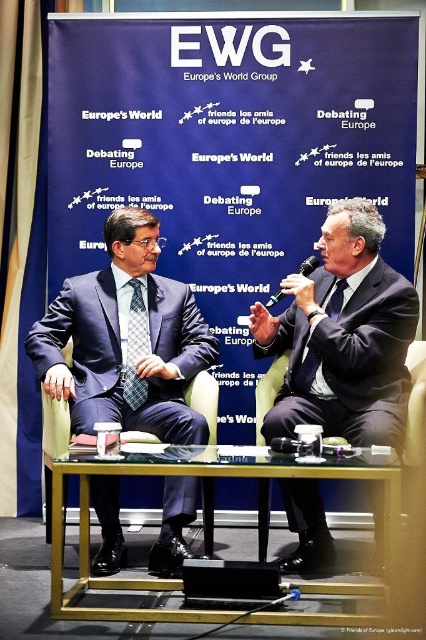
You are attending the EWG conference and need to identify which suit is larger between the matte blue suit at center and the matte black suit at center. Based on the scene description, which one is bigger?

The matte blue suit at center is bigger than the matte black suit at center according to the description.

You are a photographer setting up for a conference photo. You need to position a light source between the two points labeled point (149, 611) and point (127, 376). Which point should the light be closer to to ensure it illuminates the area between them effectively?

The light should be closer to point (149, 611) because it is nearer to the camera, making it the optimal position to evenly illuminate the space between both points.